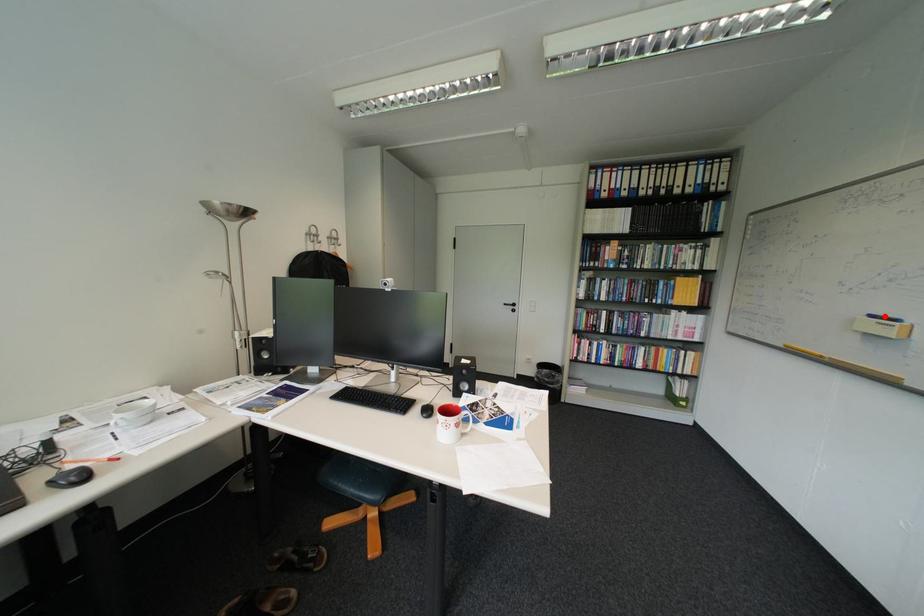
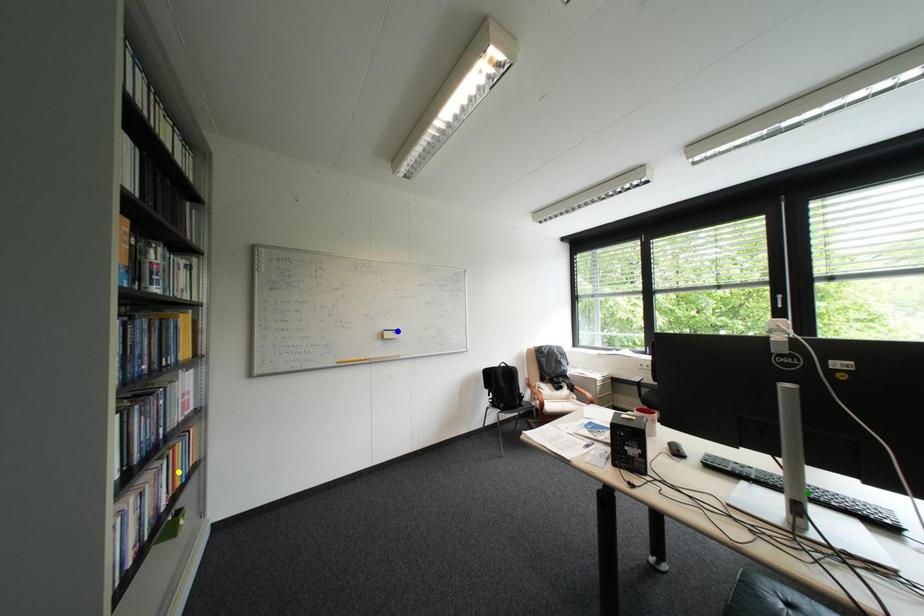
Question: I am providing you with two images of the same scene from different viewpoints. A red point is marked on the first image. You are given multiple points on the second image. Which mark in image 2 goes with the point in image 1?

Choices:
 (A) yellow point
 (B) blue point
 (C) green point

Answer: (B)